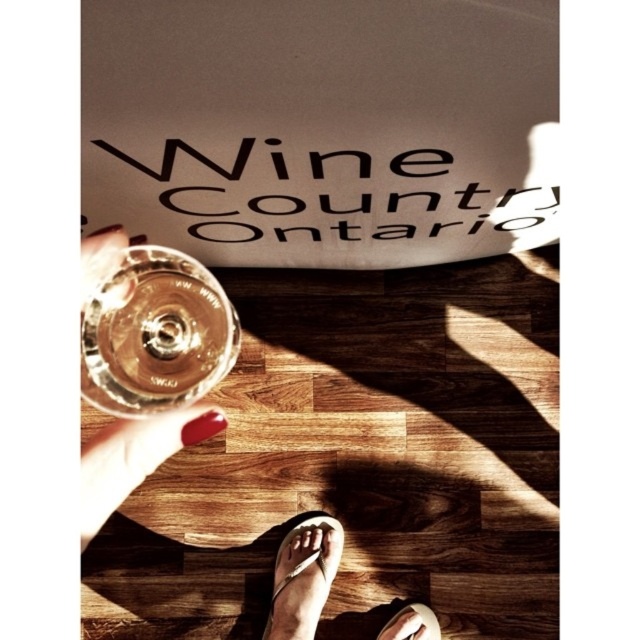
From the picture: You are holding a clear glass wine glass at center and see your white leather sandal at lower center. Can you see the sandal underneath the glass?

The clear glass wine glass at center is positioned over the white leather sandal at lower center, so yes, the sandal can be seen underneath the glass because the glass is clear.

You are holding a clear glass wine glass at center. If your hand is 12 inches away from your face, can you reach it without moving your hand?

The clear glass wine glass at center is 13.33 inches away from the viewer. Since your hand is only 12 inches away from your face, you cannot reach it without moving your hand closer.